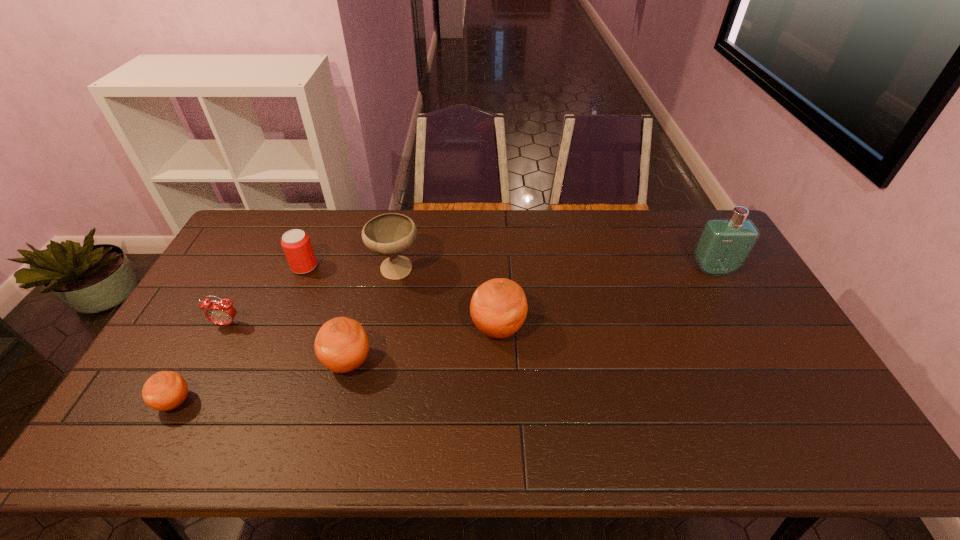
In the image, there is a desktop. Identify the location of free region at the far edge. (646, 235).

This screenshot has width=960, height=540. Find the location of `vacant space at the near edge of the desktop`. vacant space at the near edge of the desktop is located at coordinates (616, 412).

Image resolution: width=960 pixels, height=540 pixels. In order to click on free space at the left edge in this screenshot , I will do `click(238, 289)`.

This screenshot has width=960, height=540. I want to click on vacant space at the far left corner, so click(x=265, y=221).

This screenshot has height=540, width=960. In order to click on free space between the second orange from right to left and the rightmost orange in this screenshot , I will do `click(422, 345)`.

Identify the location of free space between the perfume and the beer can. The height and width of the screenshot is (540, 960). (509, 268).

At what (x,y) coordinates should I click in order to perform the action: click on vacant area between the alarm clock and the second tallest orange. Please return your answer as a coordinate pair (x, y). This screenshot has width=960, height=540. Looking at the image, I should click on (288, 343).

Where is `vacant space that's between the nearest object and the second orange from left to right`? The image size is (960, 540). vacant space that's between the nearest object and the second orange from left to right is located at coordinates (261, 382).

At what (x,y) coordinates should I click in order to perform the action: click on free point between the chalice and the third object from left to right. Please return your answer as a coordinate pair (x, y). The width and height of the screenshot is (960, 540). Looking at the image, I should click on click(x=350, y=268).

At what (x,y) coordinates should I click in order to perform the action: click on unoccupied position between the second shortest orange and the alarm clock. Please return your answer as a coordinate pair (x, y). The image size is (960, 540). Looking at the image, I should click on (288, 343).